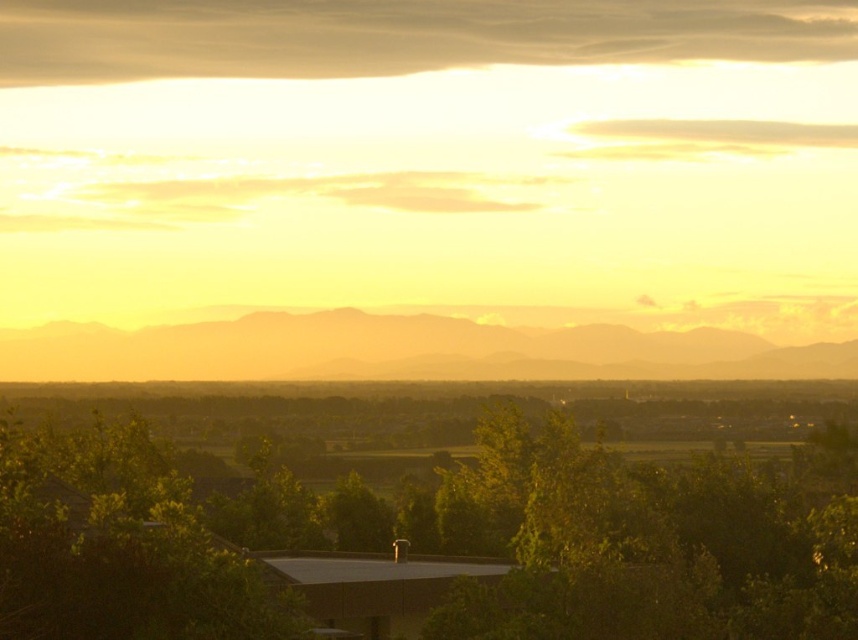
You are standing in the serene landscape scene. There are two points marked in the image. The first point is at coordinate point (539, 604) and the second is at point (777, 368). Which point is nearer to you?

Point (539, 604) is closer to the camera than point (777, 368), so the first point is nearer to you.

You are standing at the center of the image and want to walk towards the green leafy tree at center. Which direction should you head?

The green leafy tree at center is located at point (434, 544), so you should head towards the right direction since the x coordinate is higher than 0.5.

You are standing in the landscape scene and want to take a photo of both the green leafy tree at center and the dull orange mountain at center. Which object should you frame first in your camera viewfinder to ensure both are in the shot?

You should frame the dull orange mountain at center first because the green leafy tree at center is positioned on the right side of it, so by centering the mountain, the tree will naturally be included to its right in the frame.